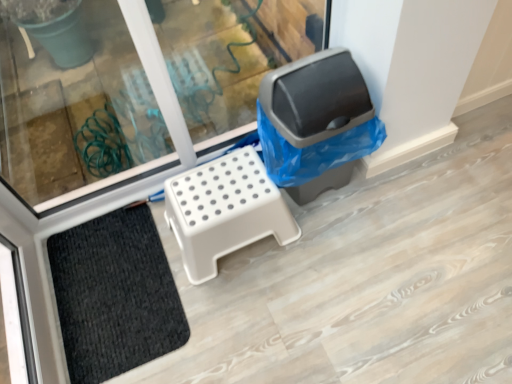
Find the location of a particular element. The width and height of the screenshot is (512, 384). free space in front of white plastic step stool at center is located at coordinates (251, 314).